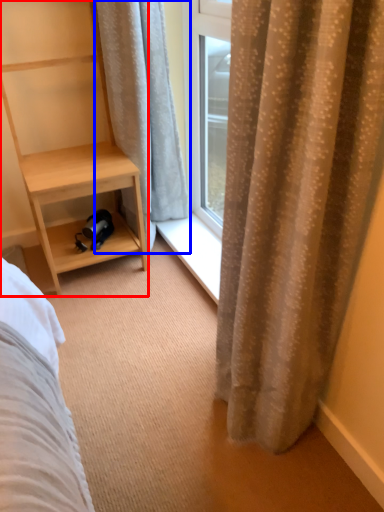
Question: Which point is further to the camera, shelf (highlighted by a red box) or curtain (highlighted by a blue box)?

Choices:
 (A) shelf
 (B) curtain

Answer: (B)